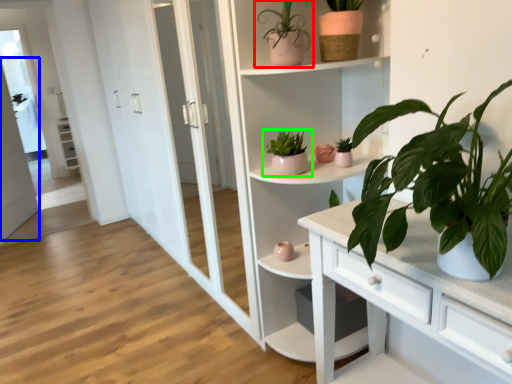
Question: Which object is the closest to the houseplant (highlighted by a red box)? Choose among these: screen door (highlighted by a blue box) or houseplant (highlighted by a green box).

Choices:
 (A) screen door
 (B) houseplant

Answer: (B)